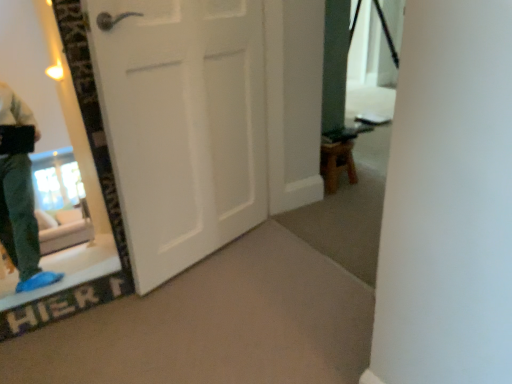
Question: Can you see white matte door at center touching wooden stool at lower right?

Choices:
 (A) yes
 (B) no

Answer: (B)

Question: Can you confirm if white matte door at center is thinner than wooden stool at lower right?

Choices:
 (A) no
 (B) yes

Answer: (B)

Question: Does white matte door at center lie in front of wooden stool at lower right?

Choices:
 (A) yes
 (B) no

Answer: (A)

Question: From a real-world perspective, does white matte door at center sit lower than wooden stool at lower right?

Choices:
 (A) no
 (B) yes

Answer: (A)

Question: Considering the relative positions of white matte door at center and wooden stool at lower right in the image provided, is white matte door at center to the left of wooden stool at lower right from the viewer's perspective?

Choices:
 (A) yes
 (B) no

Answer: (A)

Question: Does white matte door at center have a lesser height compared to wooden stool at lower right?

Choices:
 (A) yes
 (B) no

Answer: (B)

Question: Is wooden stool at lower right facing towards white matte door at center?

Choices:
 (A) no
 (B) yes

Answer: (A)

Question: Does wooden stool at lower right have a greater height compared to white matte door at center?

Choices:
 (A) yes
 (B) no

Answer: (B)

Question: Is wooden stool at lower right next to white matte door at center and touching it?

Choices:
 (A) no
 (B) yes

Answer: (A)

Question: Is wooden stool at lower right positioned before white matte door at center?

Choices:
 (A) yes
 (B) no

Answer: (B)

Question: From a real-world perspective, is wooden stool at lower right located higher than white matte door at center?

Choices:
 (A) no
 (B) yes

Answer: (A)

Question: From the image's perspective, does wooden stool at lower right appear higher than white matte door at center?

Choices:
 (A) yes
 (B) no

Answer: (A)

Question: Considering the positions of wooden stool at lower right and white matte door at center in the image, is wooden stool at lower right taller or shorter than white matte door at center?

Choices:
 (A) short
 (B) tall

Answer: (A)